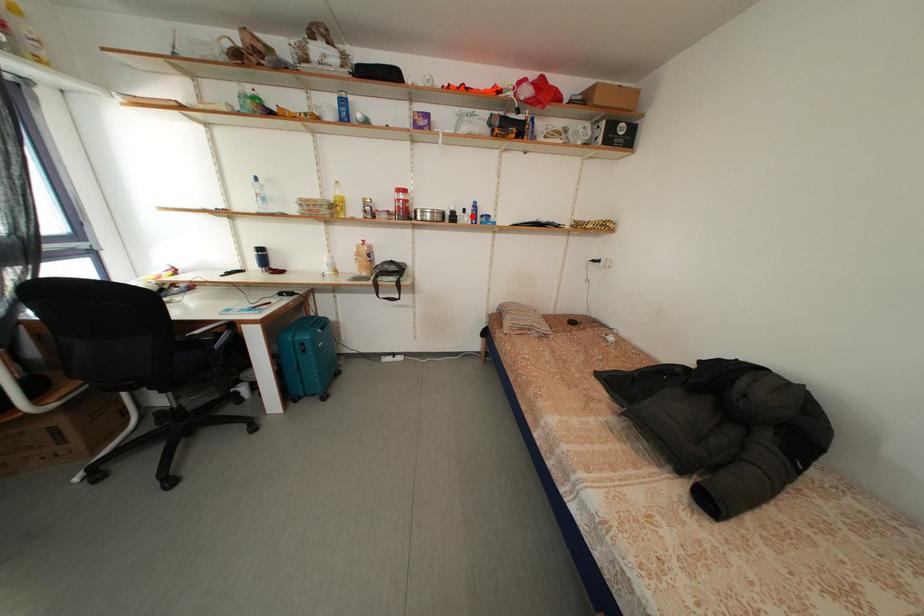
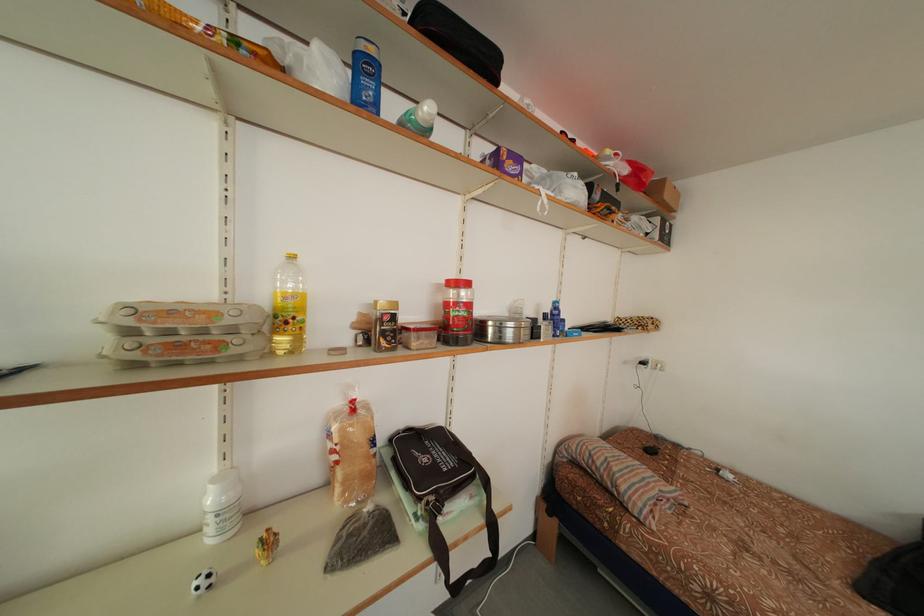
The point at the highlighted location is marked in the first image. Where is the corresponding point in the second image?

(553, 322)